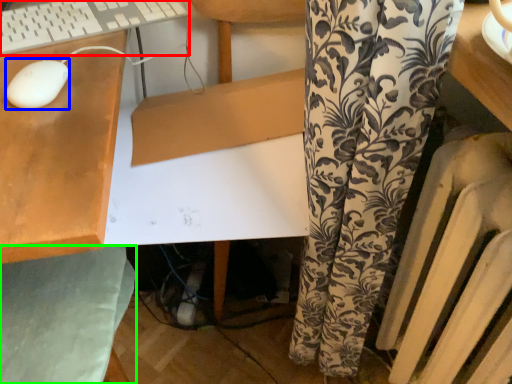
Question: Which object is positioned closest to computer keyboard (highlighted by a red box)? Select from mouse (highlighted by a blue box) and swivel chair (highlighted by a green box).

Choices:
 (A) mouse
 (B) swivel chair

Answer: (A)